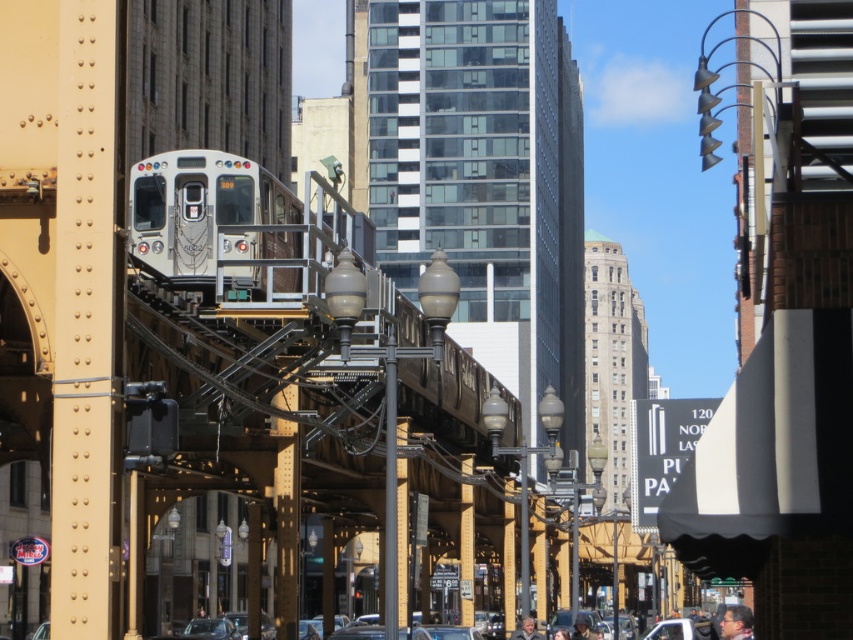
Can you confirm if silver metallic train at center is positioned to the right of metallic silver car at lower center?

Indeed, silver metallic train at center is positioned on the right side of metallic silver car at lower center.

Is silver metallic train at center in front of metallic silver car at lower center?

Yes, silver metallic train at center is closer to the viewer.

Measure the distance between silver metallic train at center and camera.

They are 77.68 meters apart.

Locate an element on the screen. Image resolution: width=853 pixels, height=640 pixels. silver metallic train at center is located at coordinates (x=196, y=211).